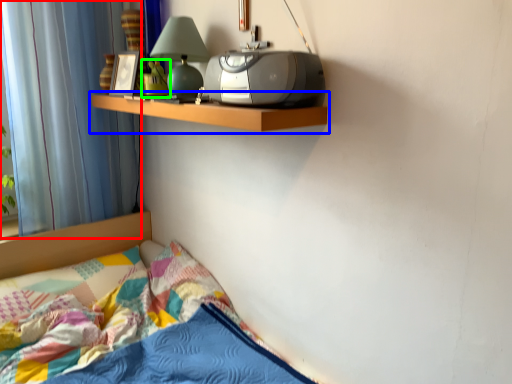
Question: Which is farther away from curtain (highlighted by a red box)? shelf (highlighted by a blue box) or toy (highlighted by a green box)?

Choices:
 (A) shelf
 (B) toy

Answer: (B)